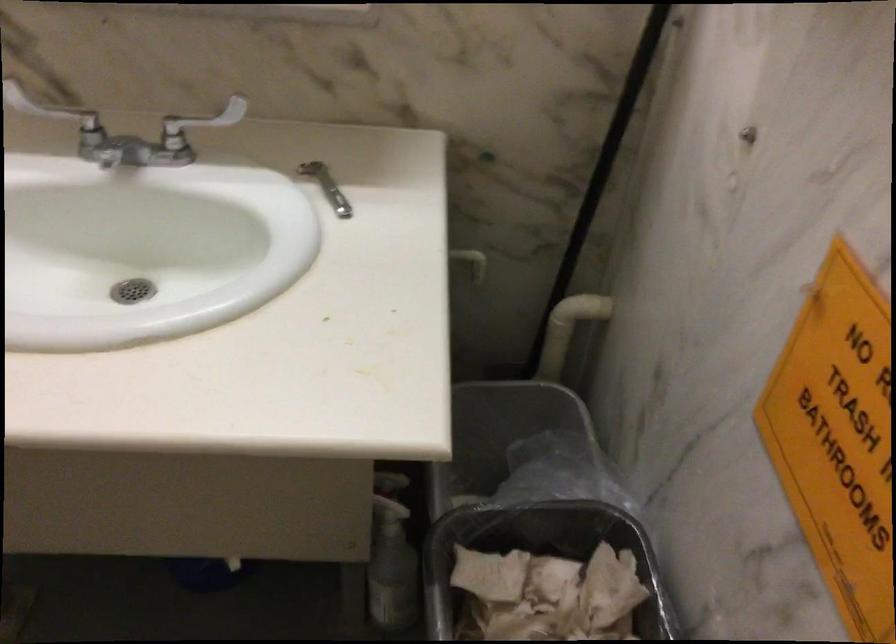
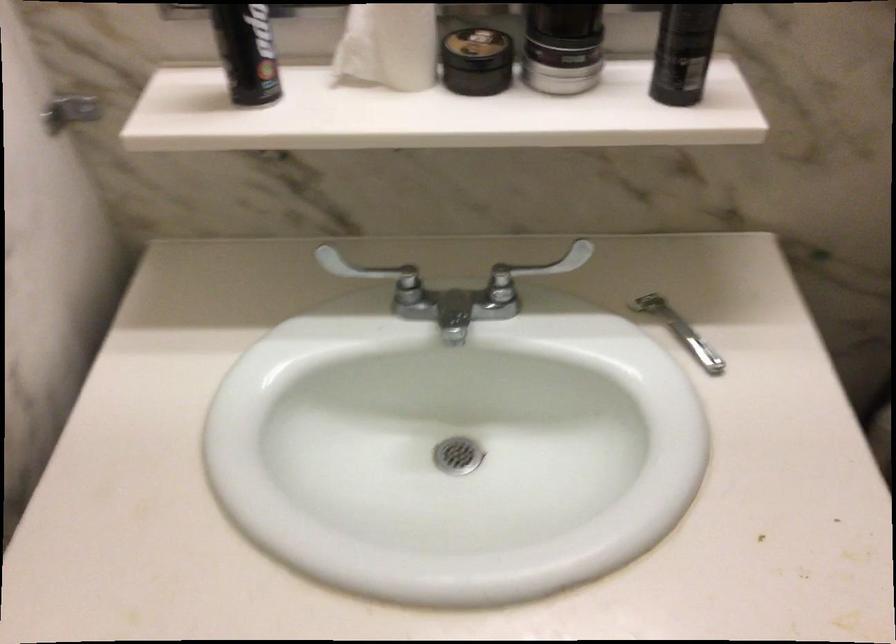
Locate, in the second image, the point that corresponds to (323,187) in the first image.

(679, 330)